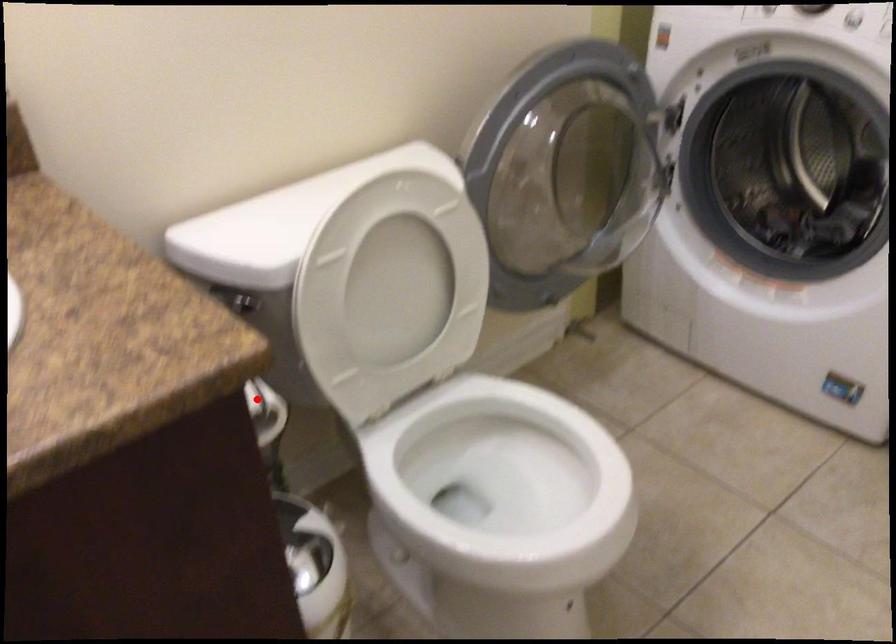
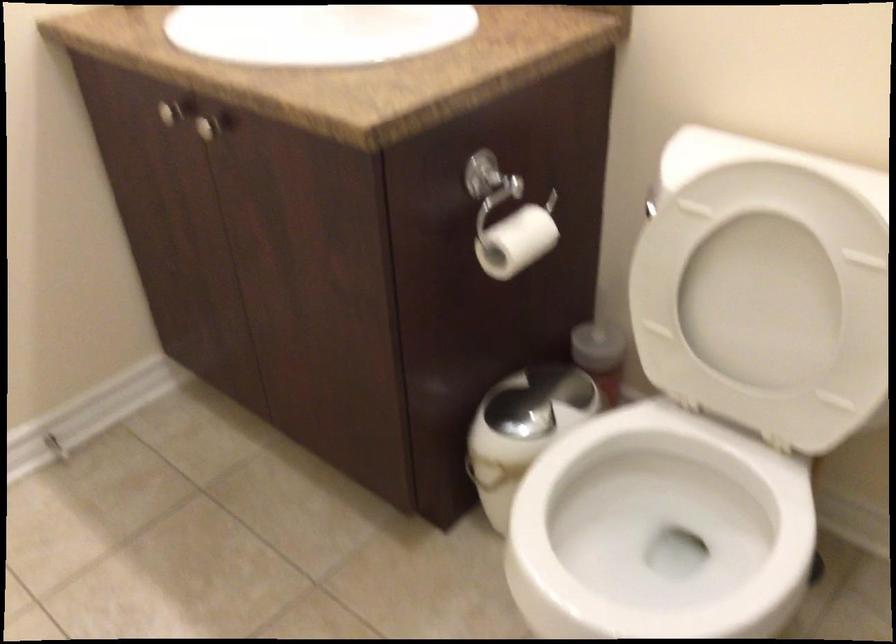
Question: A red point is marked in image1. In image2, is the corresponding 3D point closer to the camera or farther? Reply with the corresponding letter.

Choices:
 (A) The corresponding 3D point is closer.
 (B) The corresponding 3D point is farther.

Answer: (B)